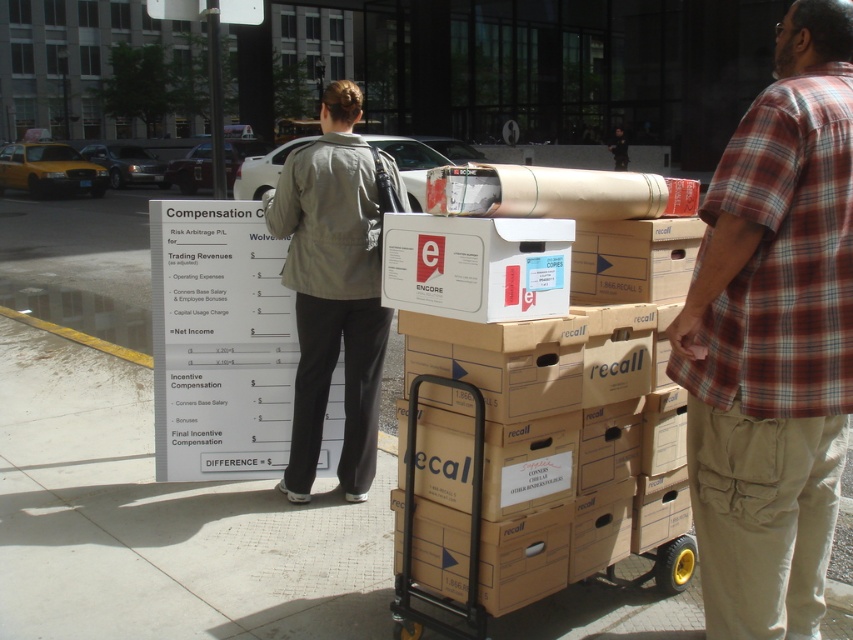
The height and width of the screenshot is (640, 853). Describe the element at coordinates (773, 339) in the screenshot. I see `plaid shirt at center` at that location.

From the picture: Who is shorter, plaid shirt at center or light gray jacket at center?

light gray jacket at center

Image resolution: width=853 pixels, height=640 pixels. What do you see at coordinates (773, 339) in the screenshot?
I see `plaid shirt at center` at bounding box center [773, 339].

Where is `plaid shirt at center`? Image resolution: width=853 pixels, height=640 pixels. plaid shirt at center is located at coordinates pos(773,339).

Is light gray jacket at center smaller than plaid cotton shirt at right?

Yes.

From the picture: Which of these two, light gray jacket at center or plaid cotton shirt at right, stands shorter?

light gray jacket at center is shorter.

I want to click on light gray jacket at center, so click(x=332, y=291).

This screenshot has height=640, width=853. Find the location of `light gray jacket at center`. light gray jacket at center is located at coordinates (332, 291).

Can you confirm if cardboard carton at center is wider than plaid cotton shirt at right?

Result: Yes, cardboard carton at center is wider than plaid cotton shirt at right.

Can you confirm if cardboard carton at center is positioned above plaid cotton shirt at right?

Actually, cardboard carton at center is below plaid cotton shirt at right.

Does point (492, 252) lie in front of point (618, 163)?

Yes, it is in front of point (618, 163).

This screenshot has width=853, height=640. I want to click on cardboard carton at center, so click(549, 445).